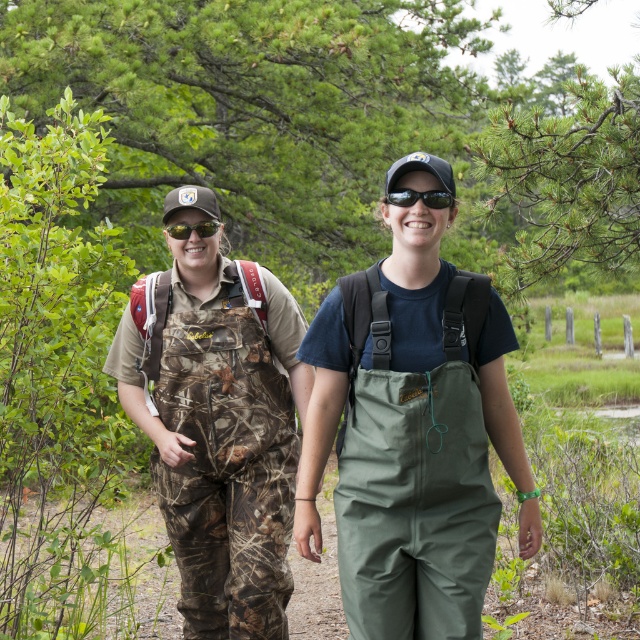
Who is taller, black reflective sunglasses at center or matte black goggles at center?

matte black goggles at center is taller.

Does black reflective sunglasses at center have a greater width compared to matte black goggles at center?

Yes, black reflective sunglasses at center is wider than matte black goggles at center.

Does point (392, 193) lie in front of point (176, 236)?

Yes, it is.

Identify the location of black reflective sunglasses at center. The height and width of the screenshot is (640, 640). (419, 196).

Does point (164, 312) come behind point (420, 192)?

That is True.

This screenshot has width=640, height=640. What do you see at coordinates (228, 435) in the screenshot? I see `camouflage fabric overalls at center` at bounding box center [228, 435].

Identify the location of camouflage fabric overalls at center. This screenshot has width=640, height=640. (228, 435).

Which is above, camouflage fabric overalls at center or matte black goggles at center?

Positioned higher is matte black goggles at center.

Image resolution: width=640 pixels, height=640 pixels. What do you see at coordinates (228, 435) in the screenshot? I see `camouflage fabric overalls at center` at bounding box center [228, 435].

The height and width of the screenshot is (640, 640). I want to click on camouflage fabric overalls at center, so click(228, 435).